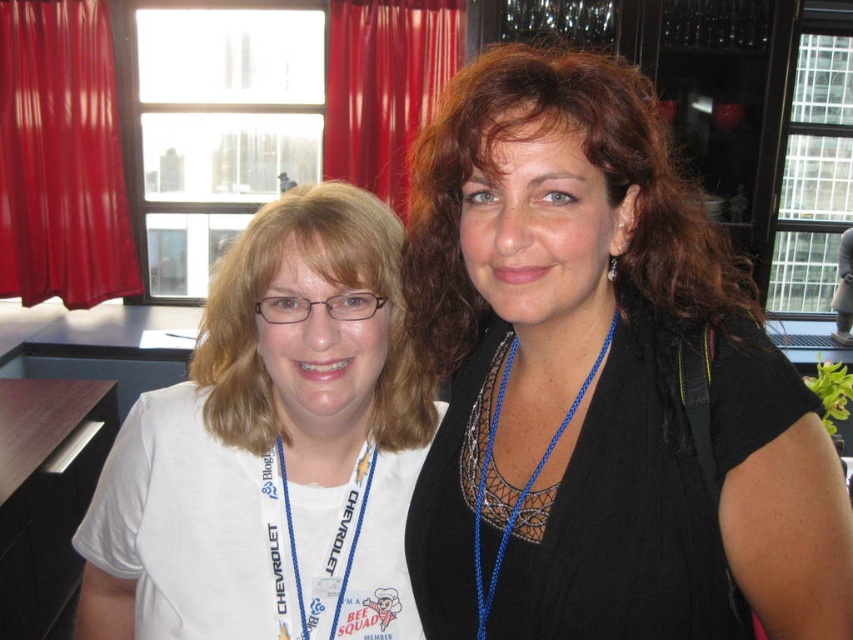
Question: Which object is positioned closest to the blue braided lanyard at center?

Choices:
 (A) red velvet curtain at upper center
 (B) red velvet curtain at upper left
 (C) black mesh top at center
 (D) blue cord at center

Answer: (C)

Question: Based on their relative distances, which object is nearer to the white cotton shirt at center?

Choices:
 (A) red velvet curtain at upper left
 (B) black mesh top at center

Answer: (B)

Question: Where is white cotton shirt at center located in relation to blue cord at center in the image?

Choices:
 (A) right
 (B) left

Answer: (B)

Question: Can you confirm if black mesh top at center is positioned to the right of red velvet curtain at upper left?

Choices:
 (A) yes
 (B) no

Answer: (A)

Question: Which point appears closest to the camera in this image?

Choices:
 (A) (485, 460)
 (B) (495, 253)
 (C) (315, 604)

Answer: (B)

Question: In this image, where is white cotton shirt at center located relative to red velvet curtain at upper left?

Choices:
 (A) right
 (B) left

Answer: (A)